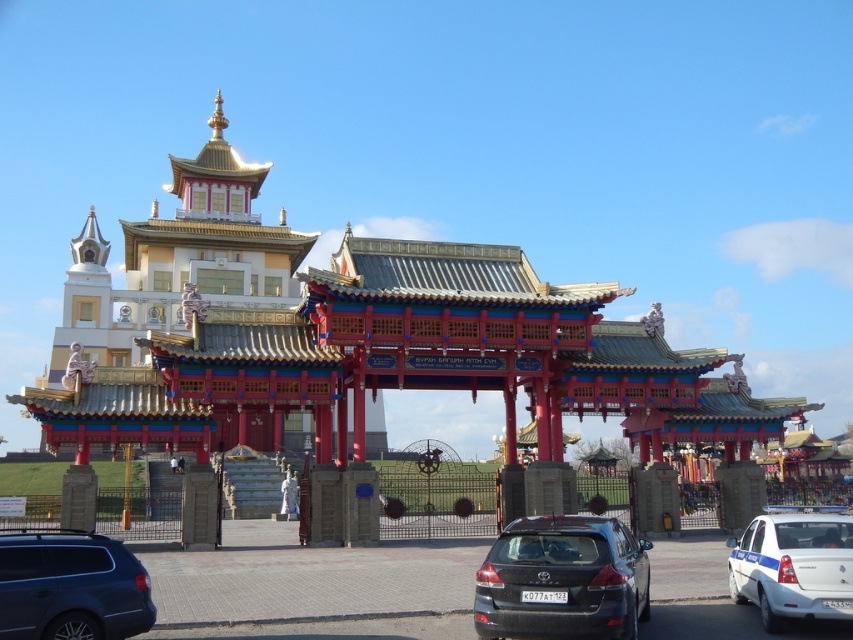
In the scene shown: You are a tour guide explaining the temple complex to visitors. You notice a matte black car at center and a metallic gray suv at lower left parked nearby. Which vehicle would appear taller when viewed from the main gate?

The matte black car at center appears taller than the metallic gray suv at lower left because it has a greater height compared to the metallic gray suv at lower left.

You are standing at point (363, 340) in the image. What is the closest object to you?

The closest object to you at point (363, 340) is the gold polished metal palace at center.